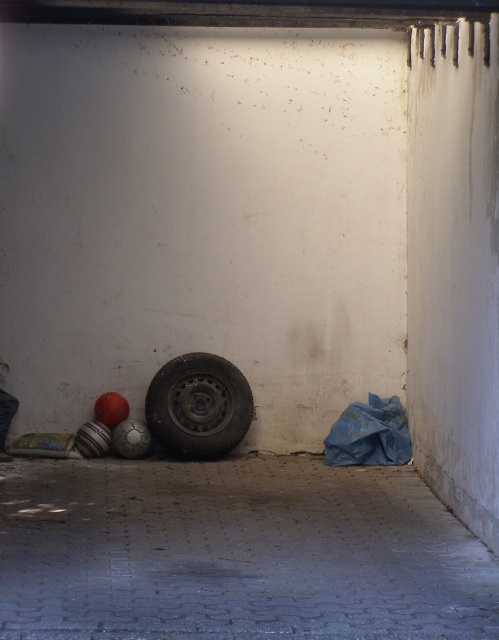
Question: Which object is closer to the camera taking this photo?

Choices:
 (A) black rubber tire at lower left
 (B) smooth concrete floor at center

Answer: (B)

Question: Which point is closer to the camera?

Choices:
 (A) smooth concrete floor at center
 (B) black rubber tire at lower left

Answer: (A)

Question: Does smooth concrete floor at center have a smaller size compared to black rubber tire at lower left?

Choices:
 (A) no
 (B) yes

Answer: (B)

Question: Can you confirm if smooth concrete floor at center is smaller than black rubber tire at lower left?

Choices:
 (A) no
 (B) yes

Answer: (B)

Question: Can you confirm if smooth concrete floor at center is positioned below black rubber tire at lower left?

Choices:
 (A) no
 (B) yes

Answer: (B)

Question: Which point is closer to the camera?

Choices:
 (A) smooth concrete floor at center
 (B) black rubber tire at lower left

Answer: (A)